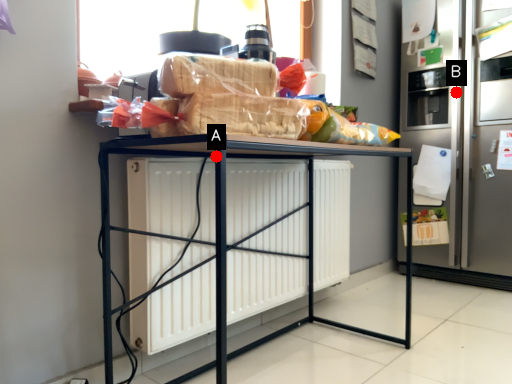
Question: Two points are circled on the image, labeled by A and B beside each circle. Which point is farther from the camera taking this photo?

Choices:
 (A) A is further
 (B) B is further

Answer: (B)